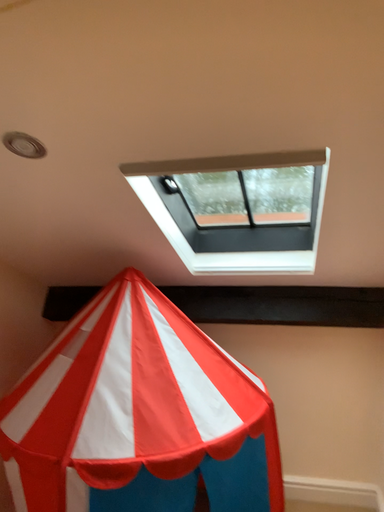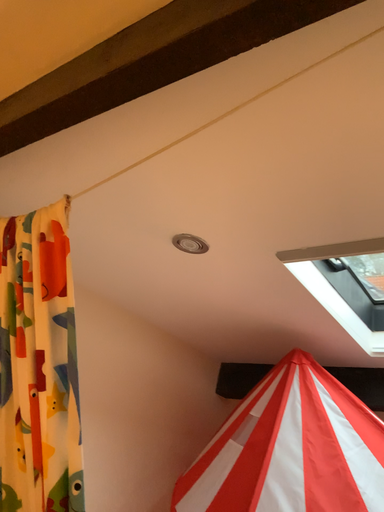
Question: Which way did the camera rotate in the video?

Choices:
 (A) rotated left
 (B) rotated right

Answer: (A)